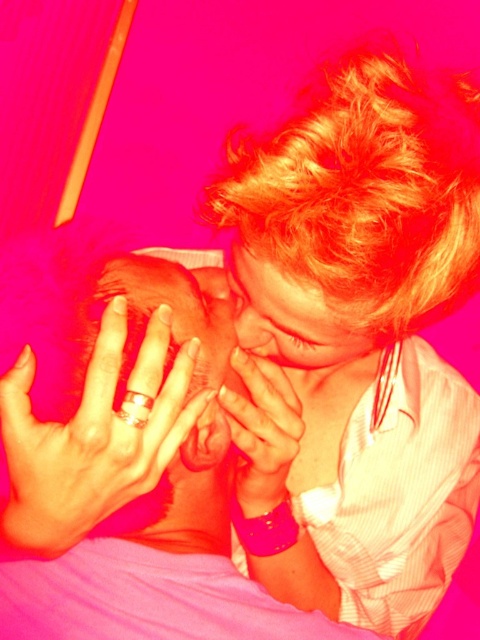
Question: Which of the following is the farthest from the observer?

Choices:
 (A) smooth skin nose at center
 (B) smooth skin face at center

Answer: (A)

Question: In this image, where is smooth skin face at center located relative to smooth skin nose at center?

Choices:
 (A) above
 (B) below

Answer: (B)

Question: Which object is the closest to the smooth skin nose at center?

Choices:
 (A) smooth skin baby at center
 (B) smooth skin face at center

Answer: (B)

Question: Which of the following is the farthest from the observer?

Choices:
 (A) smooth skin face at center
 (B) smooth skin baby at center
 (C) smooth skin nose at center

Answer: (C)

Question: In this image, where is smooth skin baby at center located relative to smooth skin nose at center?

Choices:
 (A) below
 (B) above

Answer: (A)

Question: Considering the relative positions of smooth skin baby at center and smooth skin nose at center in the image provided, where is smooth skin baby at center located with respect to smooth skin nose at center?

Choices:
 (A) above
 (B) below

Answer: (B)